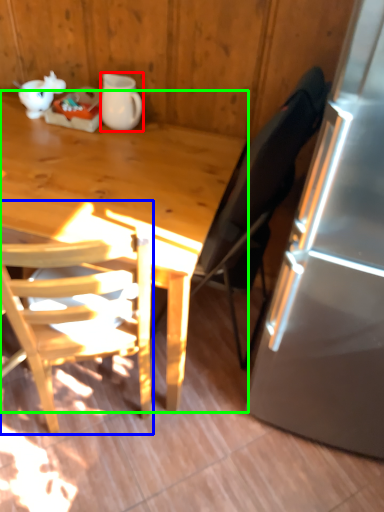
Question: Considering the real-world distances, which object is closest to pitcher (highlighted by a red box)? chair (highlighted by a blue box) or desk (highlighted by a green box).

Choices:
 (A) chair
 (B) desk

Answer: (B)